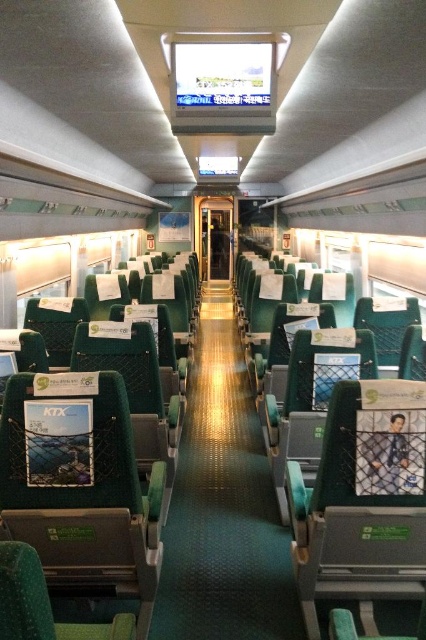
You are a passenger sitting in the train carriage and want to reach a point in the scene. Which of the two points, point (184, 580) or point (405, 467), is closer to you?

Point (405, 467) is closer to you because it is less further to the camera than point (184, 580).

You are a passenger on the train and want to move from your seat to the exit door located at the end of the green fabric coach at center. Which direction should you walk relative to the green fabric aisle at center?

You should walk to the right of the green fabric aisle at center because the green fabric aisle at center is to the left of the green fabric coach at center, so moving right would lead towards the exit door at the coach end.

You are a passenger carrying a 2.5 meter long ladder that you need to move through the green fabric aisle at center. Can you safely carry the ladder through the aisle without hitting anything?

The green fabric aisle at center is 2.44 meters wide. Since the ladder is 2.5 meters long, it is slightly longer than the aisle width, so you cannot safely carry the ladder through the aisle without risking a collision.